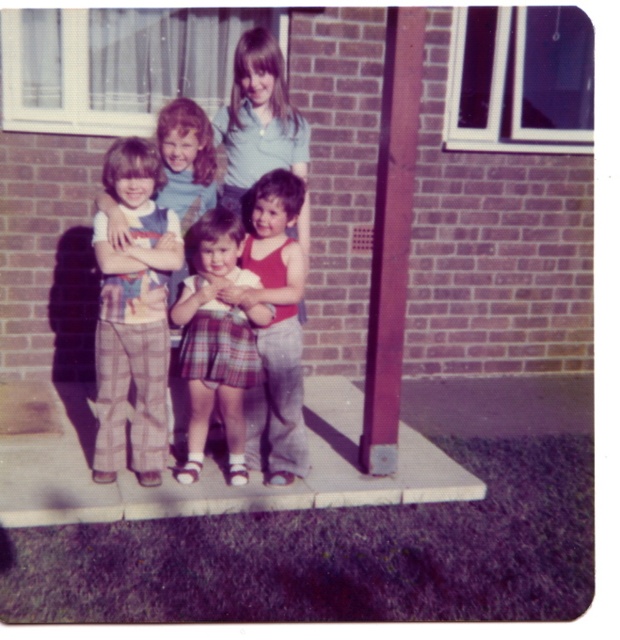
Which of these two, matte red tank top at center or matte blue shirt at center, stands shorter?

matte blue shirt at center

Is point (268, 176) less distant than point (246, 164)?

Yes.

Is point (286, 451) in front of point (272, 106)?

Yes, it is in front of point (272, 106).

This screenshot has height=640, width=620. Identify the location of matte red tank top at center. (275, 328).

Based on the photo, is plaid pants at left wider than smooth purple pole at center?

Indeed, plaid pants at left has a greater width compared to smooth purple pole at center.

Is point (133, 147) positioned after point (386, 90)?

No, (133, 147) is closer to viewer.

This screenshot has height=640, width=620. What are the coordinates of `plaid pants at left` in the screenshot? It's located at (133, 316).

Who is positioned more to the right, plaid skirt at center or matte red tank top at center?

Positioned to the right is matte red tank top at center.

Is plaid skirt at center thinner than matte red tank top at center?

No, plaid skirt at center is not thinner than matte red tank top at center.

Which is in front, point (186, 296) or point (291, 177)?

Point (186, 296)

Locate an element on the screen. plaid skirt at center is located at coordinates (217, 339).